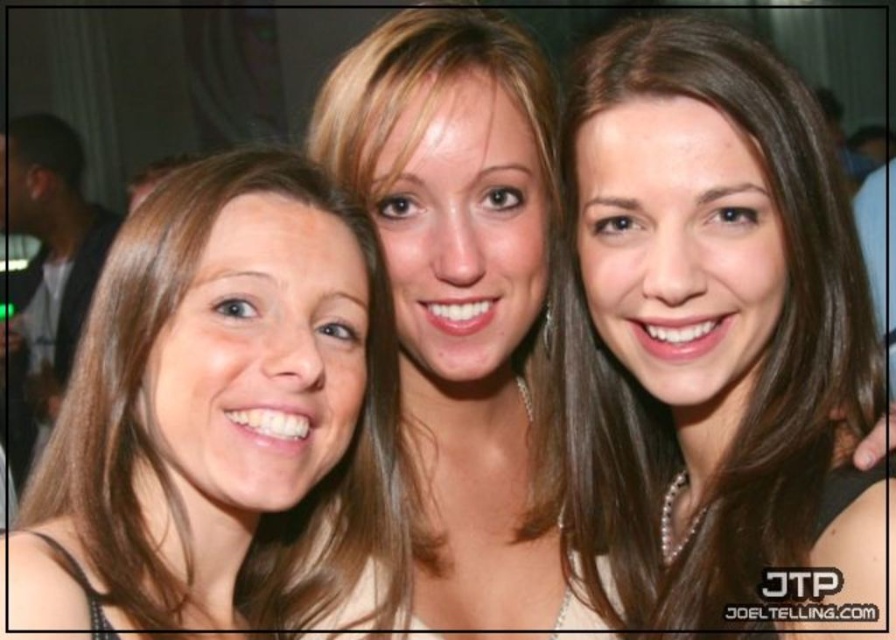
What do you see at coordinates (717, 339) in the screenshot? The height and width of the screenshot is (640, 896). I see `brown hair at center` at bounding box center [717, 339].

Between point (748, 346) and point (39, 308), which one is positioned behind?

Positioned behind is point (39, 308).

Where is `brown hair at center`? The height and width of the screenshot is (640, 896). brown hair at center is located at coordinates (717, 339).

Where is `brown hair at center`? The height and width of the screenshot is (640, 896). brown hair at center is located at coordinates (717, 339).

Can you confirm if blonde hair at center is wider than smooth skin face at center?

No.

Locate an element on the screen. The width and height of the screenshot is (896, 640). blonde hair at center is located at coordinates (224, 424).

The image size is (896, 640). I want to click on blonde hair at center, so click(224, 424).

Can you confirm if brown hair at center is bigger than blonde hair at center?

Indeed, brown hair at center has a larger size compared to blonde hair at center.

Is point (645, 435) positioned in front of point (194, 452)?

No, it is behind (194, 452).

This screenshot has width=896, height=640. Find the location of `brown hair at center`. brown hair at center is located at coordinates (717, 339).